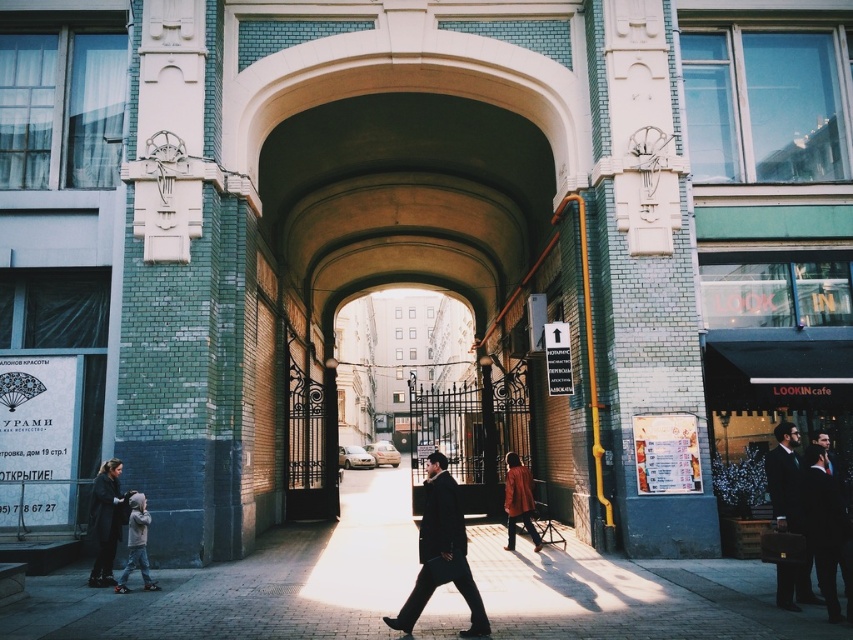
Question: Which object appears farthest from the camera in this image?

Choices:
 (A) brick alley at center
 (B) black matte suit at lower right
 (C) black suit at center

Answer: (B)

Question: Which point is farther from the camera taking this photo?

Choices:
 (A) (125, 509)
 (B) (834, 604)
 (C) (785, 602)
 (D) (527, 506)

Answer: (D)

Question: In this image, where is dark suit at right located relative to light gray jacket at lower left?

Choices:
 (A) right
 (B) left

Answer: (A)

Question: Does black matte suit at lower right appear on the right side of matte orange coat at center?

Choices:
 (A) yes
 (B) no

Answer: (A)

Question: Where is dark gray wool business suit at lower left located in relation to light gray jacket at lower left in the image?

Choices:
 (A) below
 (B) above

Answer: (B)

Question: Which point is farther from the camera taking this photo?

Choices:
 (A) (107, 529)
 (B) (438, 540)
 (C) (827, 516)
 (D) (526, 508)

Answer: (D)